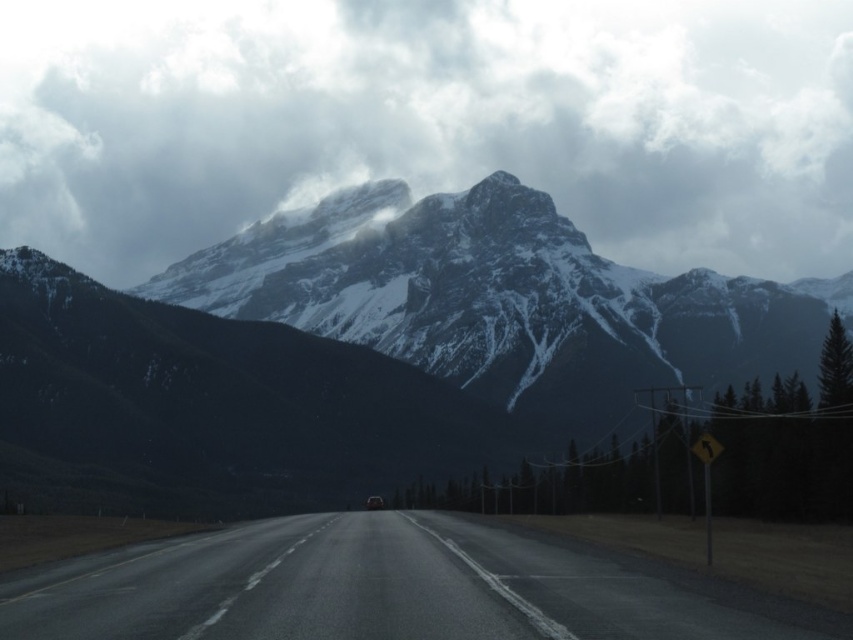
You are driving along the two lane road and want to know if you can see point (70, 180) before point (460, 541). Based on the scene, which point would you encounter first?

Point (70, 180) is closer to the viewer than point (460, 541), so you would encounter point (70, 180) first.

You are a driver approaching the shiny silver car at center on the wet road. You notice a snowy rock formation at upper center in your view. Based on the scene, which object is closer to you, the driver?

The snowy rock formation at upper center is positioned over the shiny silver car at center, meaning the shiny silver car at center is closer to you since objects in front are lower in the visual field.